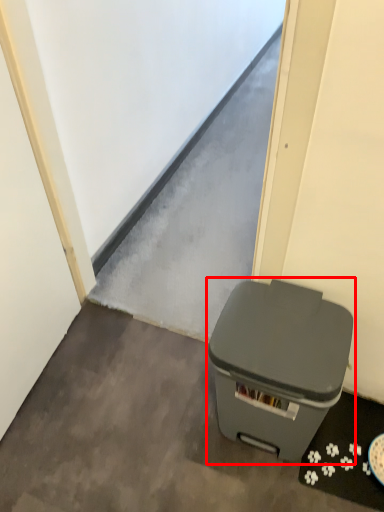
Question: Considering the relative positions of waste container (annotated by the red box) and concrete in the image provided, where is waste container (annotated by the red box) located with respect to the staircase?

Choices:
 (A) right
 (B) left

Answer: (A)